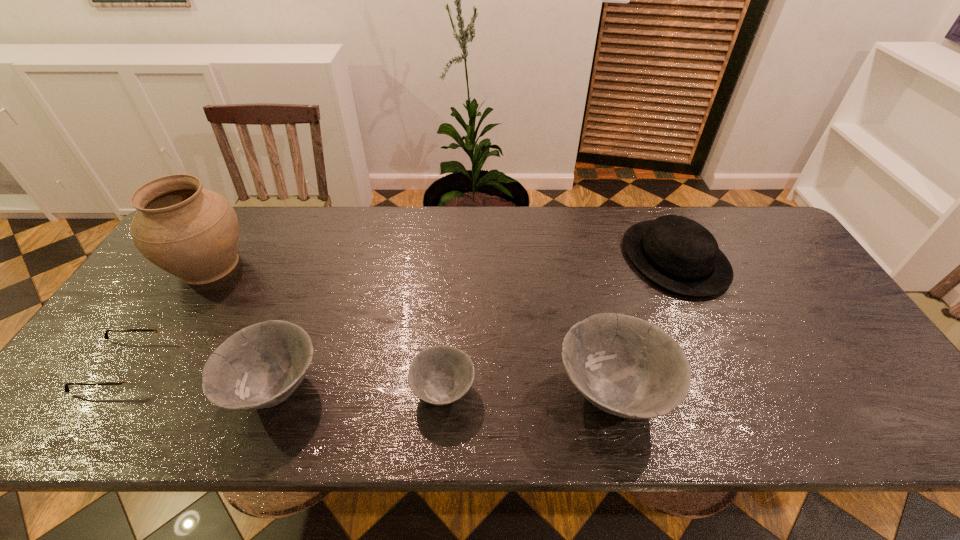
Choose which bowl is the nearest neighbor to the leftmost bowl. Please provide its 2D coordinates. Your answer should be formatted as a tuple, i.e. [(x, y)], where the tuple contains the x and y coordinates of a point satisfying the conditions above.

[(439, 375)]

Locate an element on the screen. The image size is (960, 540). vacant space that satisfies the following two spatial constraints: 1. on the back side of the fifth object from left to right; 2. on the left side of the rightmost object is located at coordinates (581, 259).

Locate an element on the screen. vacant position in the image that satisfies the following two spatial constraints: 1. at the hinge ends of the fifth object from left to right; 2. on the right side of the spectacles is located at coordinates (105, 393).

You are a GUI agent. You are given a task and a screenshot of the screen. Output one action in this format:
    pyautogui.click(x=<x>, y=<y>)
    Task: Click on the free space that satisfies the following two spatial constraints: 1. on the front side of the fedora; 2. at the hinge ends of the shortest object
    The height and width of the screenshot is (540, 960).
    Given the screenshot: What is the action you would take?
    pyautogui.click(x=725, y=366)